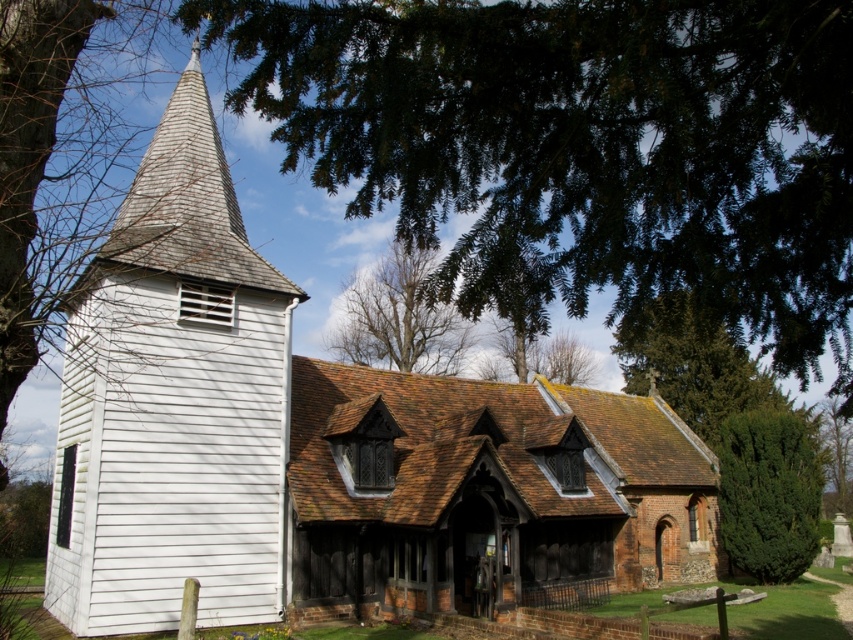
You are standing in front of the church and want to know which plant is closer to the entrance. The plants you see are the green textured bush at right and the green leafy tree at right. Can you determine which one is closer?

The green textured bush at right is shorter than the green leafy tree at right, but height does not determine proximity. You need to look at their positions relative to the entrance. Since both are at the right side, their distance from the entrance cannot be determined by height alone.

Looking at this image, you are standing in front of the church and notice two elements near the entrance area. Which one is positioned to the right side of the other? The green textured bush at right and the bare branches at center are both visible. Please specify which is on the right.

The green textured bush at right is positioned to the right of the bare branches at center.

You are standing at the entrance of the church and want to water the green textured bush at right. If your watering can has a range of 90 feet, can you reach it without moving closer?

The green textured bush at right is 92.84 feet away from the viewer. Since the watering can only reaches 90 feet, you cannot reach it without moving closer.